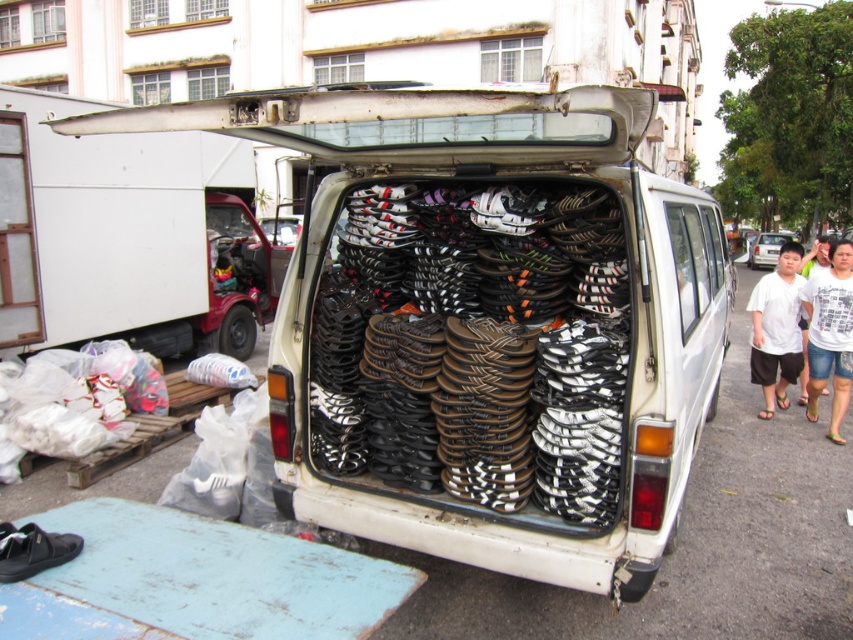
You are standing in front of the van and want to determine the relative positions of two points marked in the image. Which point is closer to you, point [311,516] or point [762,387]?

Point [311,516] is closer to the viewer than point [762,387].

You are a delivery person who needs to pack the black matte sandals at center and the white cotton shirt at right into a box. Which item requires a narrower box?

The black matte sandals at center requires a narrower box since it has a lesser width compared to the white cotton shirt at right.